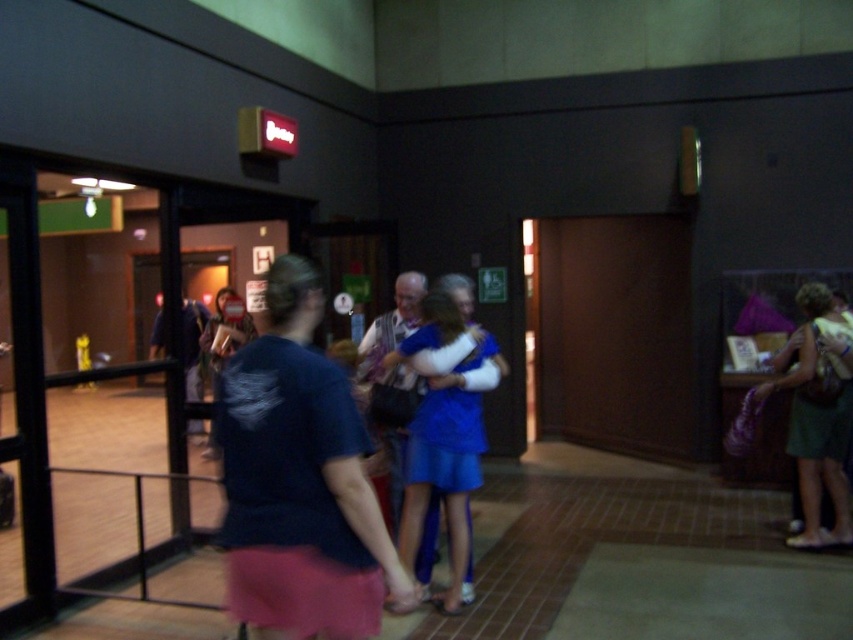
You are organizing a clothing display and need to arrange the green fabric dress at right and the matte blue dress at center based on their widths. Which dress should you place on the narrower rack designed for smaller garments?

The green fabric dress at right has a lesser width compared to the matte blue dress at center, so it should be placed on the narrower rack designed for smaller garments.